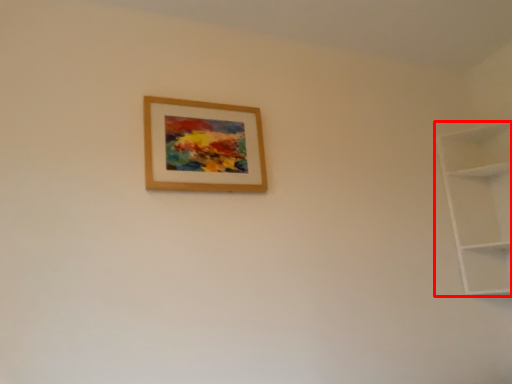
Question: In this image, where is shelf (annotated by the red box) located relative to picture frame?

Choices:
 (A) left
 (B) right

Answer: (B)